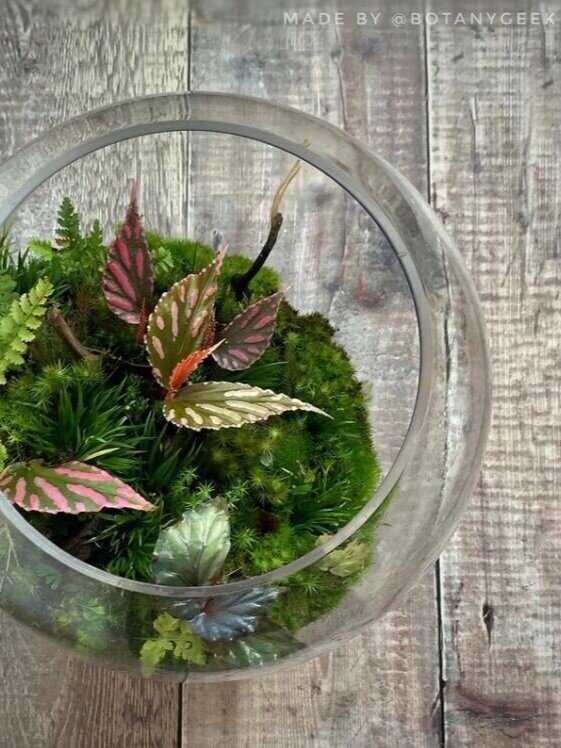
Find the location of a particular element. Image resolution: width=561 pixels, height=748 pixels. table is located at coordinates (516, 571).